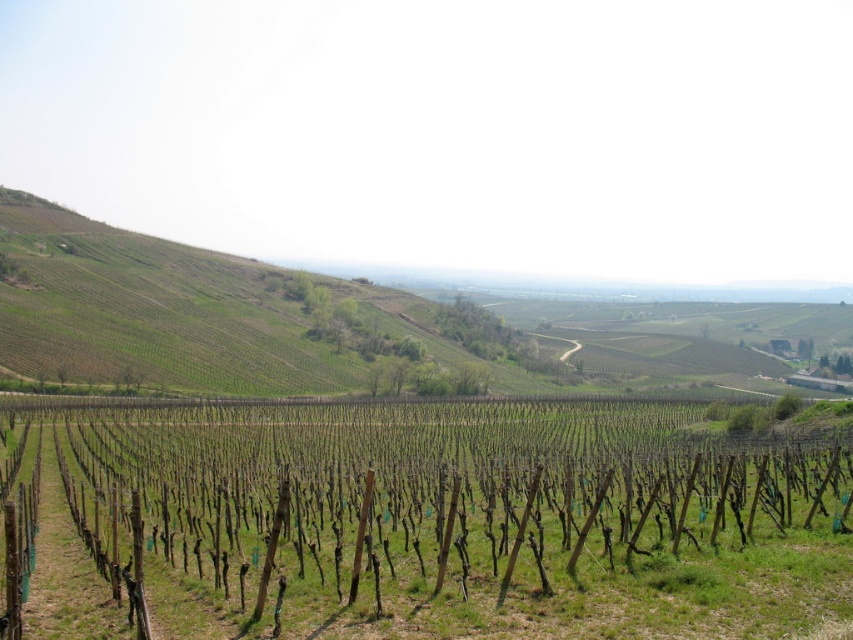
You are standing in the vineyard and see the green wood pole at center and the green grassy hillside at upper left. Which object is closer to you?

The green wood pole at center is closer to you because it is positioned in front of the green grassy hillside at upper left.

You are standing at the base of the green wood pole at center and want to climb to the top of the green grassy hillside at upper left. Which one do you need to ascend first?

You need to ascend the green wood pole at center first because it is shorter than the green grassy hillside at upper left, so you can reach its top before tackling the taller hillside.

You are standing at the origin point in the image. Which direction should you move to reach the green wood pole at center?

The green wood pole at center is located at coordinates approximately 0.817 along the x axis and 0.491 along the y axis. Since you are at the origin, you should move towards the right and slightly forward to reach it.